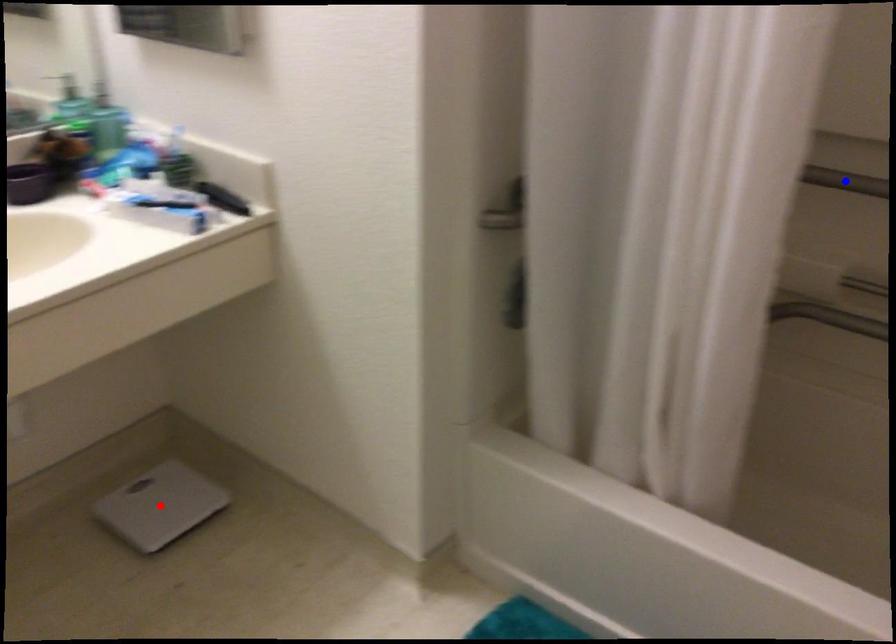
Question: In the image, two points are highlighted. Which point is nearer to the camera? Reply with the corresponding letter.

Choices:
 (A) blue point
 (B) red point

Answer: (A)